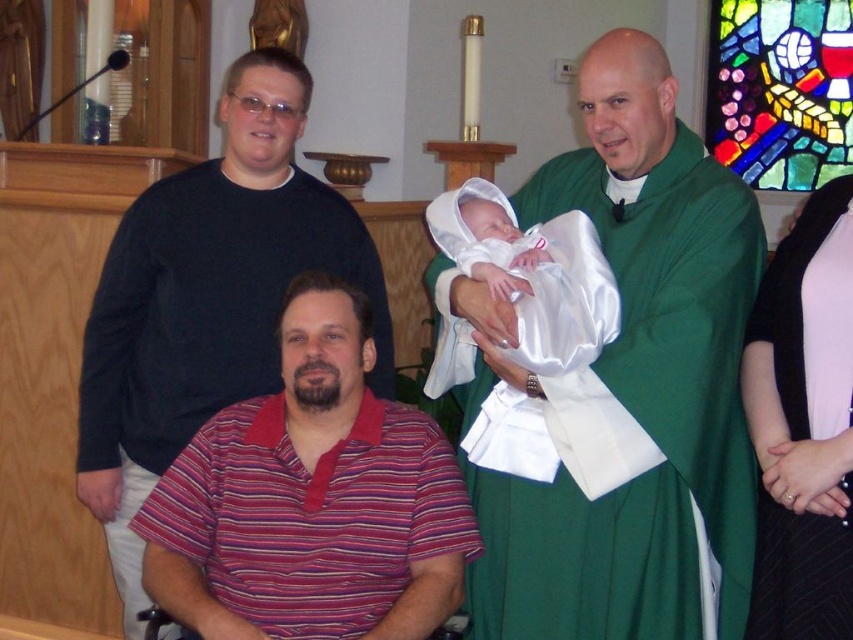
In the church scene, there is a green satin robe at center and a black matte shirt at upper left. Which of these two items is narrower?

The green satin robe at center is narrower than the black matte shirt at upper left.

Consider the image. You are a photographer adjusting your camera settings to capture the best possible shot of the green satin robe at center and the black matte shirt at upper left. Since you want both subjects to be in focus, which one should you prioritize focusing on first to ensure depth of field accommodates both?

The green satin robe at center is closer to the viewer than the black matte shirt at upper left. To ensure both are in focus, prioritize focusing on the farther object, the black matte shirt at upper left, as depth of field typically extends about one third in front of and two thirds behind the point of focus.

In the church scene, you notice two items of clothing, the green satin robe at center and the pink satin dress at right. Which one is positioned higher in the image?

The green satin robe at center is positioned higher than the pink satin dress at right.